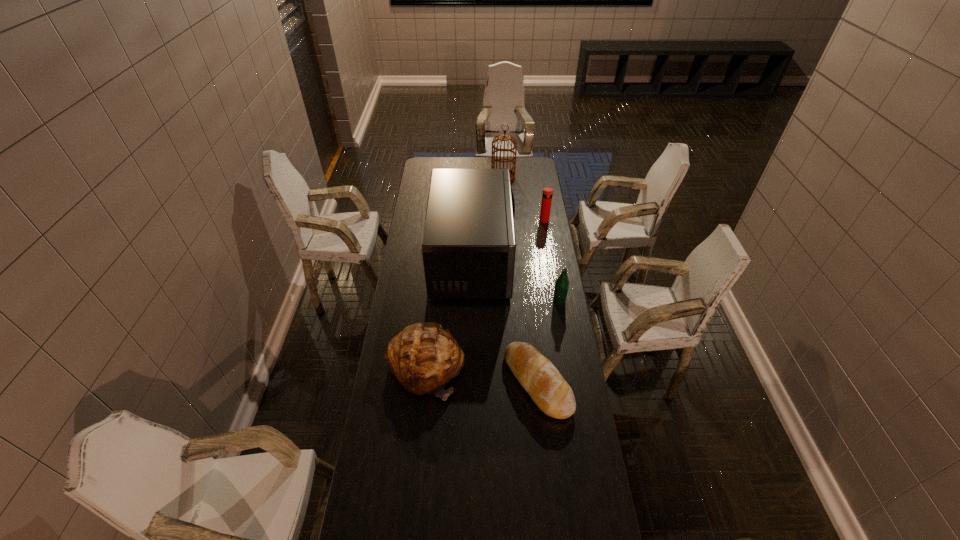
At what (x,y) coordinates should I click in order to perform the action: click on vacant space at the right edge. Please return your answer as a coordinate pair (x, y). The image size is (960, 540). Looking at the image, I should click on tap(544, 459).

This screenshot has height=540, width=960. Find the location of `free spot between the left bread and the shortest object`. free spot between the left bread and the shortest object is located at coordinates (482, 375).

This screenshot has width=960, height=540. Identify the location of vacant point located between the microwave oven and the bottle. (516, 280).

Image resolution: width=960 pixels, height=540 pixels. Find the location of `free spot between the microwave oven and the taller bread`. free spot between the microwave oven and the taller bread is located at coordinates (449, 313).

At what (x,y) coordinates should I click in order to perform the action: click on free area in between the left bread and the microwave oven. Please return your answer as a coordinate pair (x, y). Looking at the image, I should click on (449, 313).

At what (x,y) coordinates should I click in order to perform the action: click on unoccupied position between the right bread and the birdcage. Please return your answer as a coordinate pair (x, y). The height and width of the screenshot is (540, 960). Looking at the image, I should click on (520, 280).

Where is `free point between the bottle and the birdcage`? The image size is (960, 540). free point between the bottle and the birdcage is located at coordinates (x=531, y=240).

Identify which object is the nearest to the shorter bread. Please provide its 2D coordinates. Your answer should be formatted as a tuple, i.e. [(x, y)], where the tuple contains the x and y coordinates of a point satisfying the conditions above.

[(424, 357)]

Where is `the second closest object to the right bread`? The image size is (960, 540). the second closest object to the right bread is located at coordinates (562, 283).

The image size is (960, 540). In order to click on vacant space that satisfies the following two spatial constraints: 1. on the front side of the right bread; 2. on the left side of the birdcage in this screenshot , I will do 516,383.